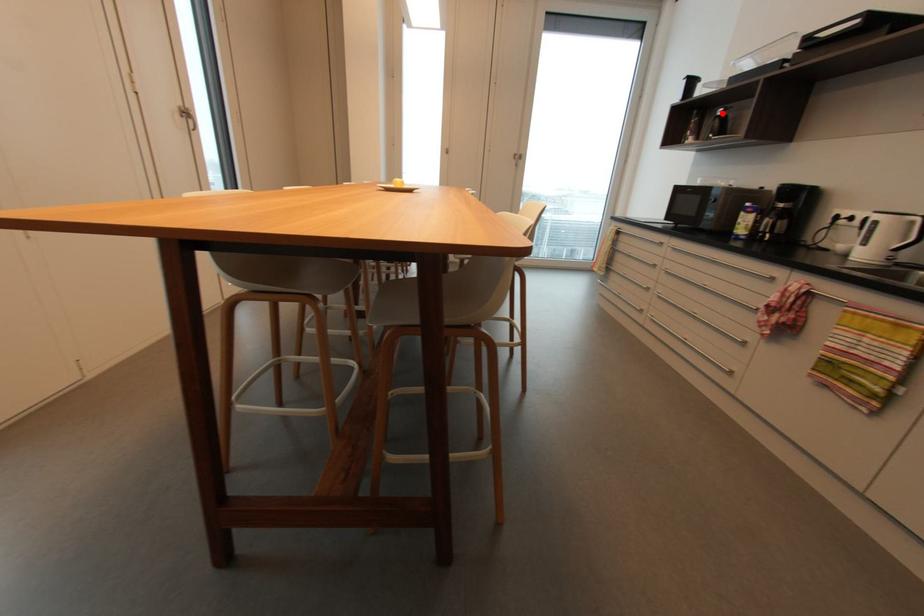
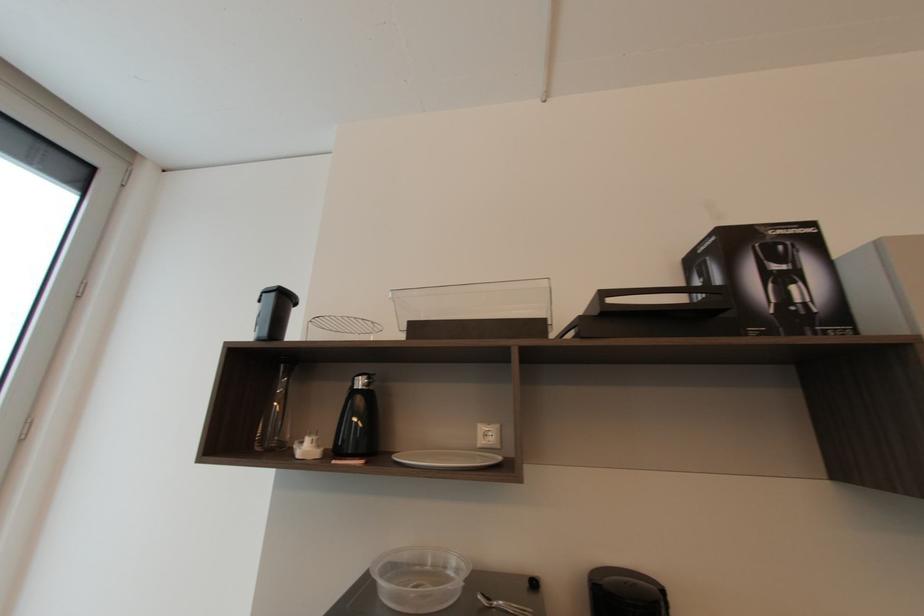
Where in the second image is the point corresponding to the highlighted location from the first image?

(362, 384)